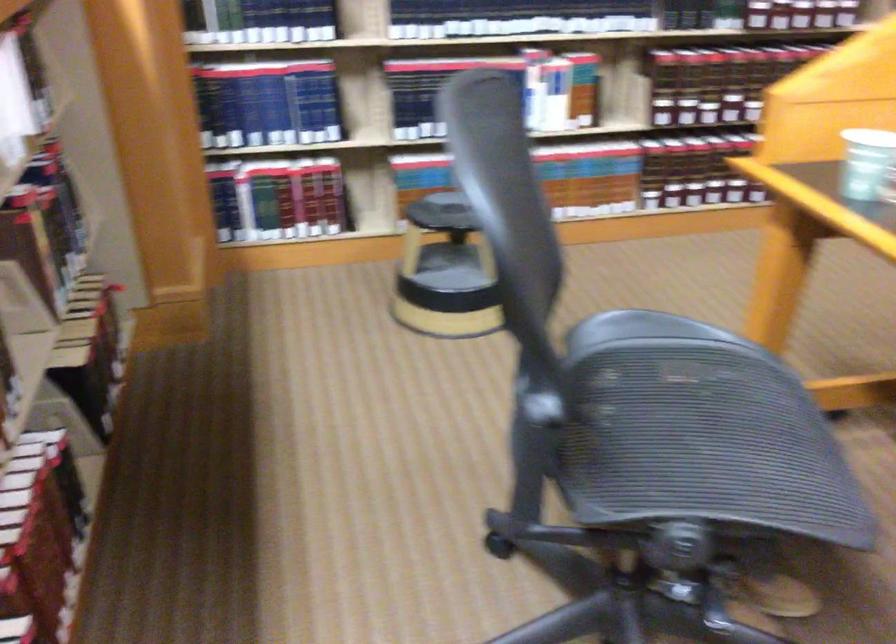
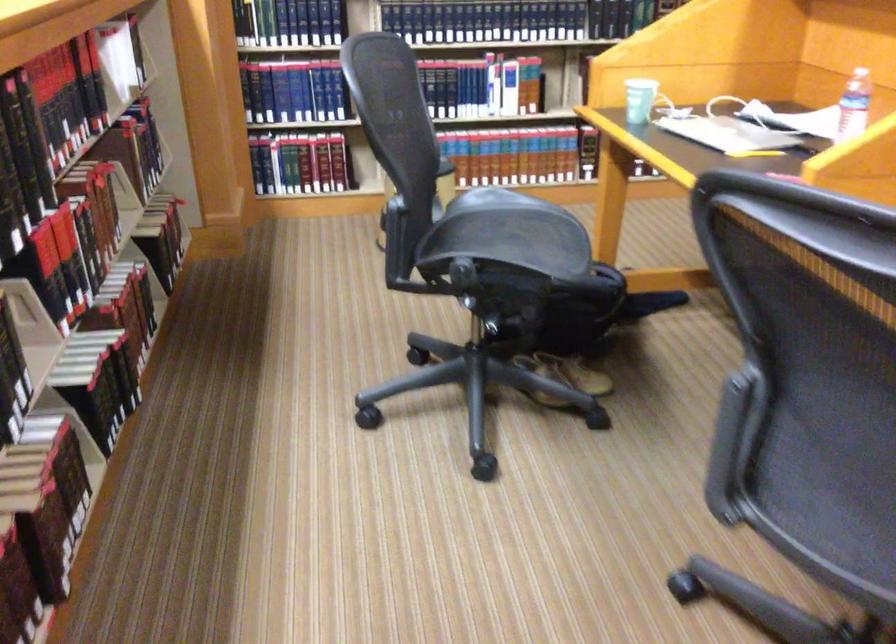
In the second image, find the point that corresponds to pixel 658 366 in the first image.

(500, 221)